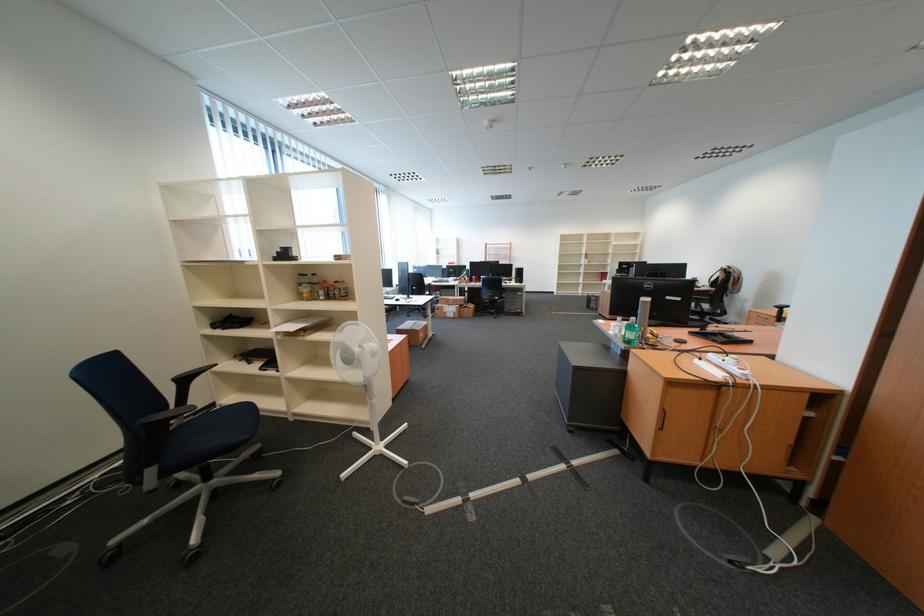
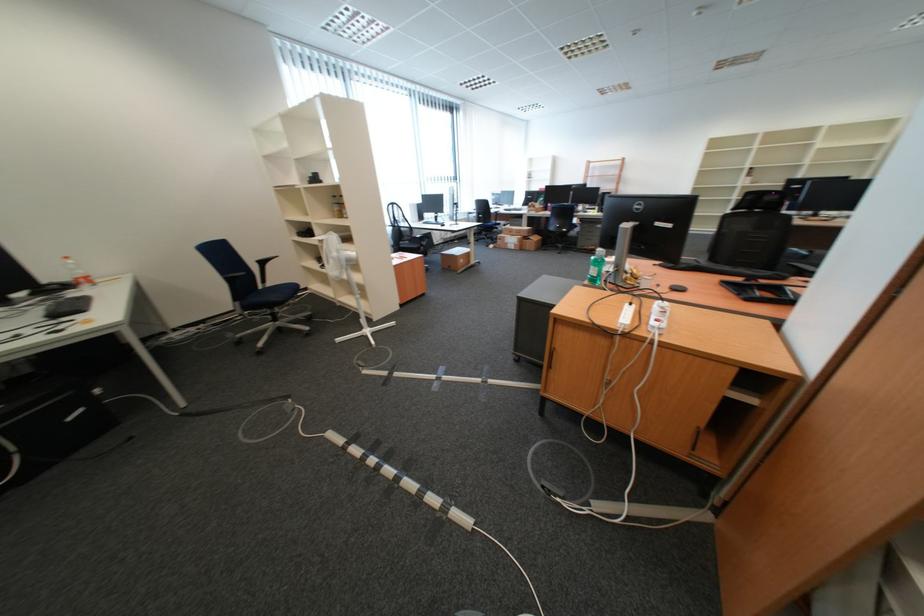
Find the pixel in the second image that matches (749,376) in the first image.

(661, 328)